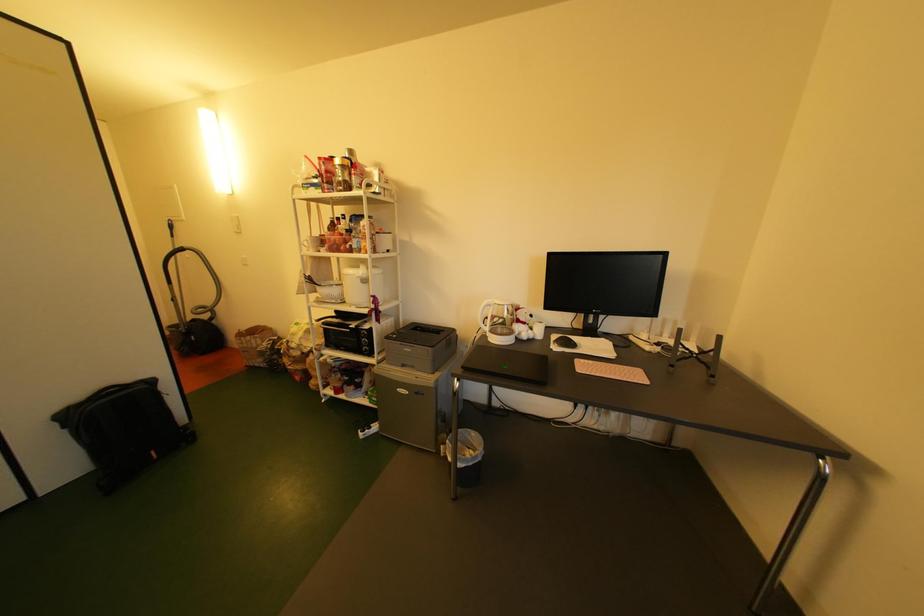
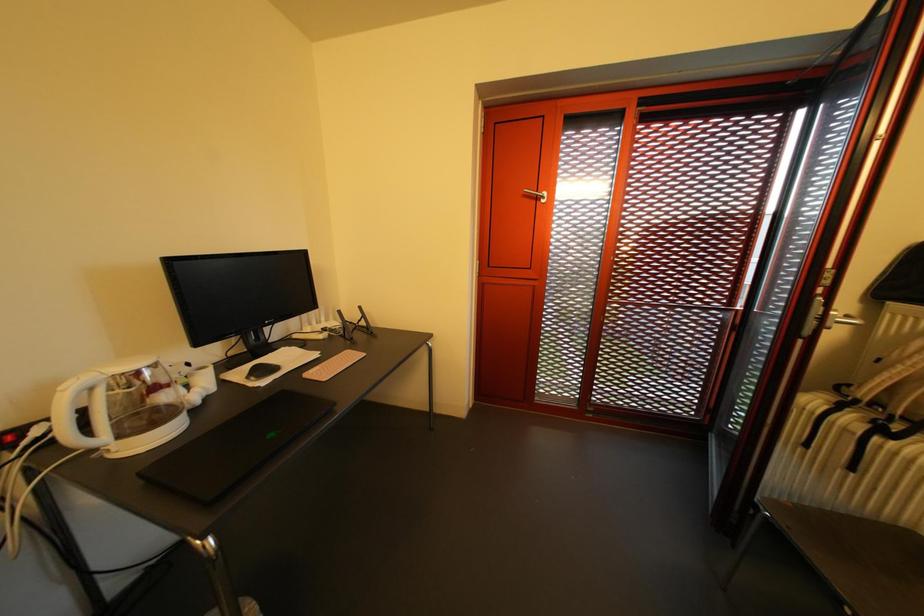
From the picture: How did the camera likely rotate?

The camera rotated toward right-down.